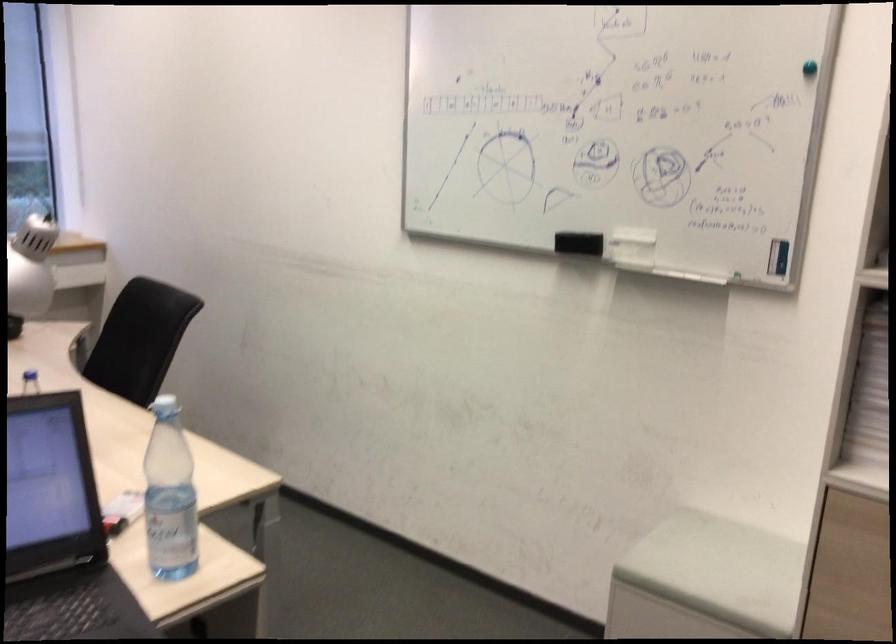
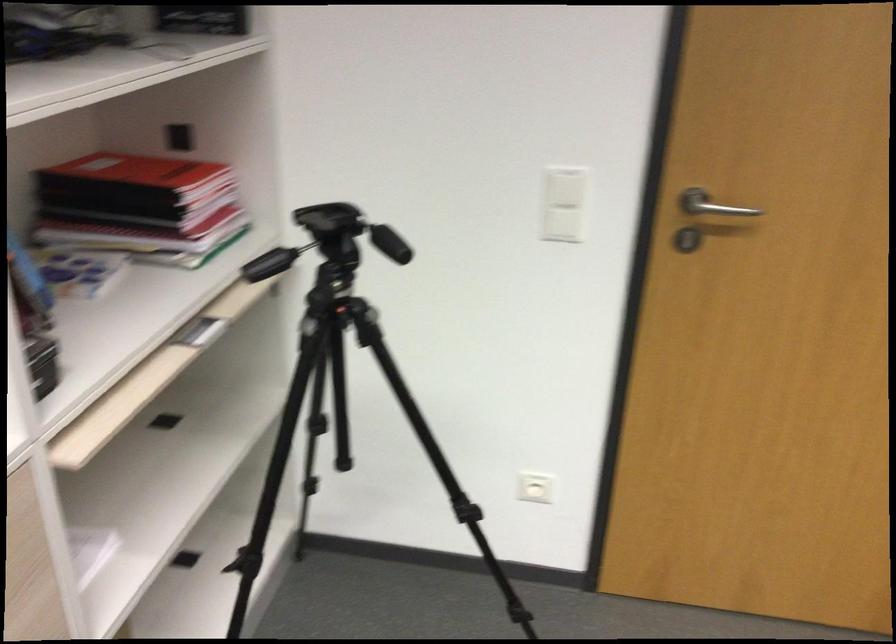
The images are taken continuously from a first-person perspective. In which direction is your viewpoint rotating?

The camera rotated toward right-down.